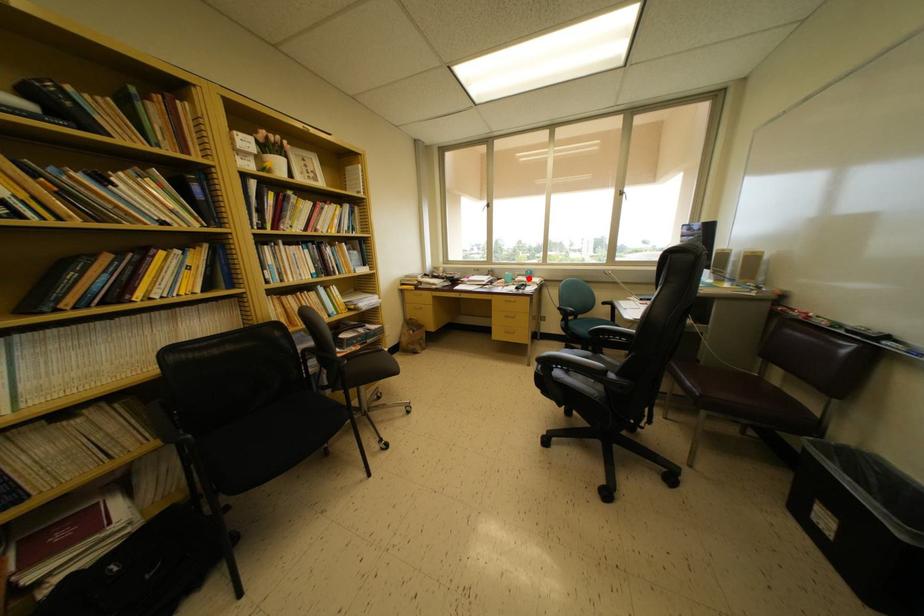
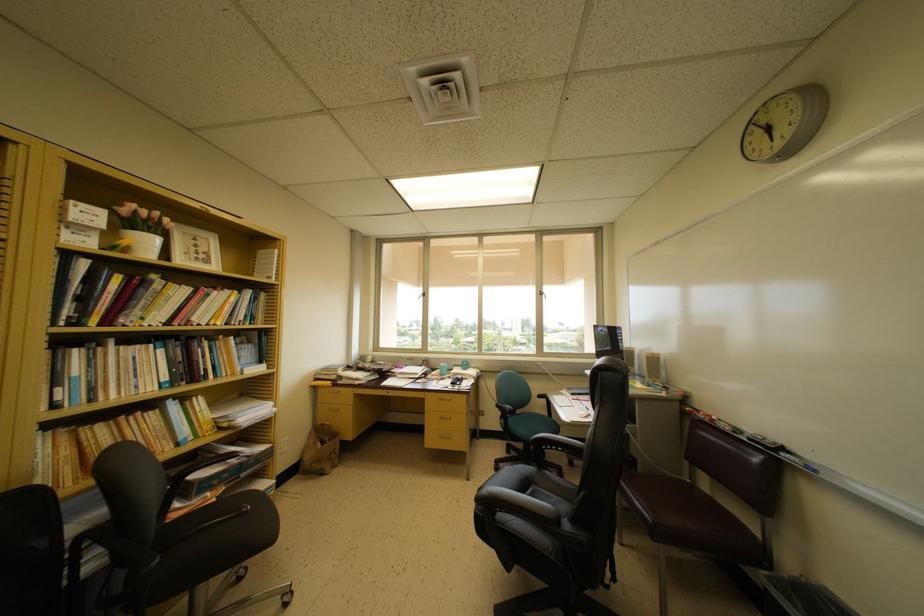
Where in the second image is the point corresponding to the highlighted location from the first image?

(465, 369)